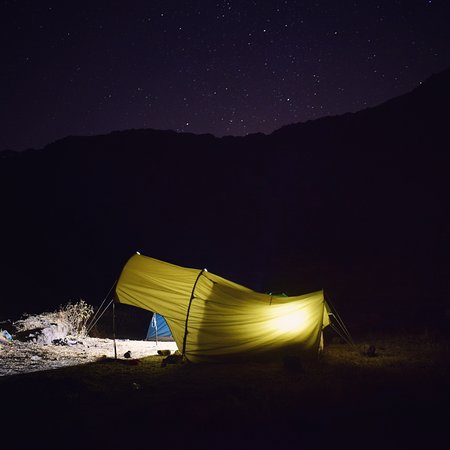
I want to click on lantern, so click(x=286, y=324).